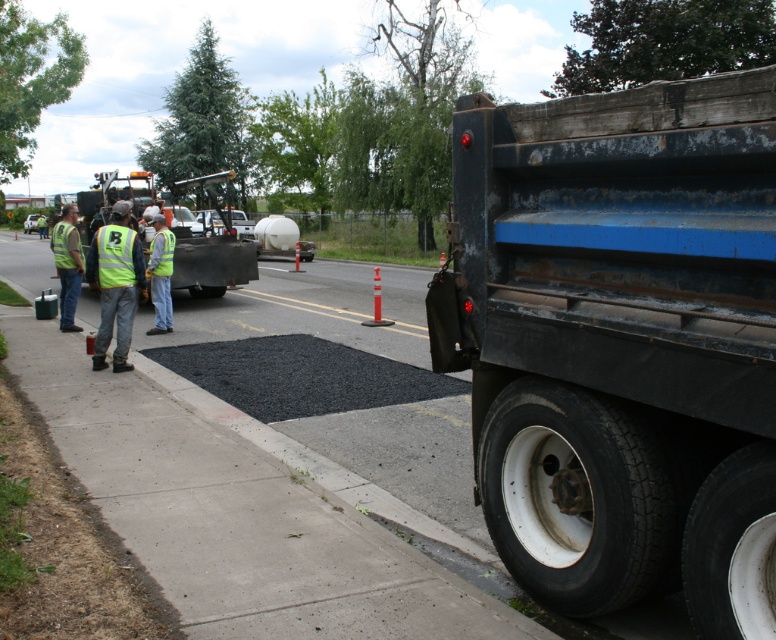
Question: Among these objects, which one is farthest from the camera?

Choices:
 (A) reflective yellow vest at left
 (B) high-visibility fabric safety vest at left

Answer: (A)

Question: Is black asphalt spreader at center to the right of reflective yellow vest at left from the viewer's perspective?

Choices:
 (A) yes
 (B) no

Answer: (B)

Question: Can you confirm if black asphalt at center is positioned to the left of reflective yellow vest at left?

Choices:
 (A) yes
 (B) no

Answer: (B)

Question: Considering the relative positions of black asphalt at center and black asphalt spreader at center in the image provided, where is black asphalt at center located with respect to black asphalt spreader at center?

Choices:
 (A) above
 (B) below

Answer: (B)

Question: Which point is farther from the camera taking this photo?

Choices:
 (A) (2, 241)
 (B) (109, 177)

Answer: (A)

Question: Which object is positioned closest to the rusty metal trailer truck at right?

Choices:
 (A) black asphalt at center
 (B) yellow reflective vest at left
 (C) reflective yellow vest at left
 (D) high-visibility fabric safety vest at left

Answer: (A)